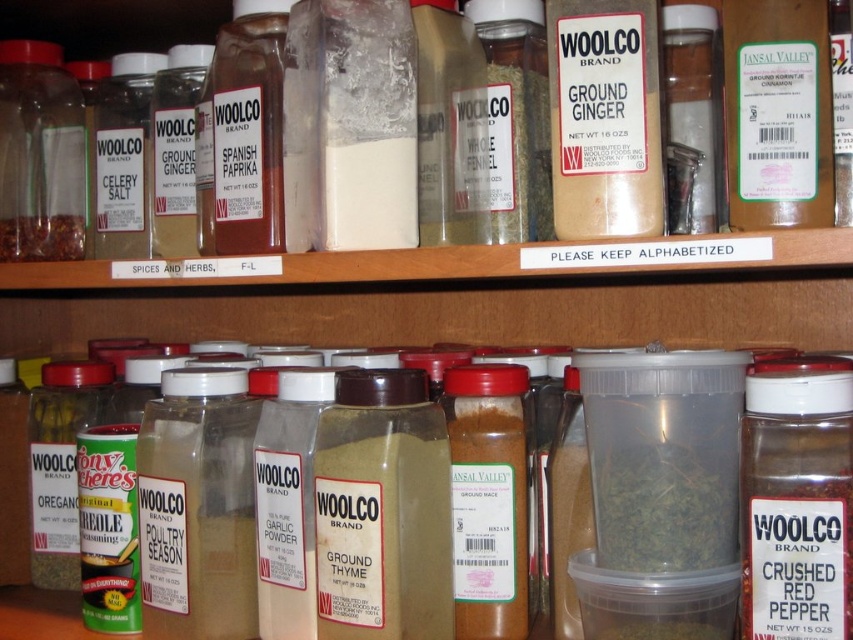
Question: Is green matte ground cinnamon at upper right to the left of matte glass jar at upper left from the viewer's perspective?

Choices:
 (A) no
 (B) yes

Answer: (A)

Question: From the image, what is the correct spatial relationship of clear plastic jar at center in relation to brown powder spice at left?

Choices:
 (A) below
 (B) above

Answer: (B)

Question: Which object is closer to the camera taking this photo?

Choices:
 (A) brown powder spice at left
 (B) matte plastic crushed red pepper at lower right

Answer: (B)

Question: Can you confirm if green herb at center is smaller than brown powder spice at left?

Choices:
 (A) no
 (B) yes

Answer: (A)

Question: Which point is farther to the camera?

Choices:
 (A) matte glass jar at upper left
 (B) brown powder spice at left
 (C) clear plastic jar at center
 (D) green matte ground cinnamon at upper right

Answer: (B)

Question: Which of these objects is positioned farthest from the green herb at center?

Choices:
 (A) green matte ground cinnamon at upper right
 (B) clear plastic jar at center

Answer: (B)